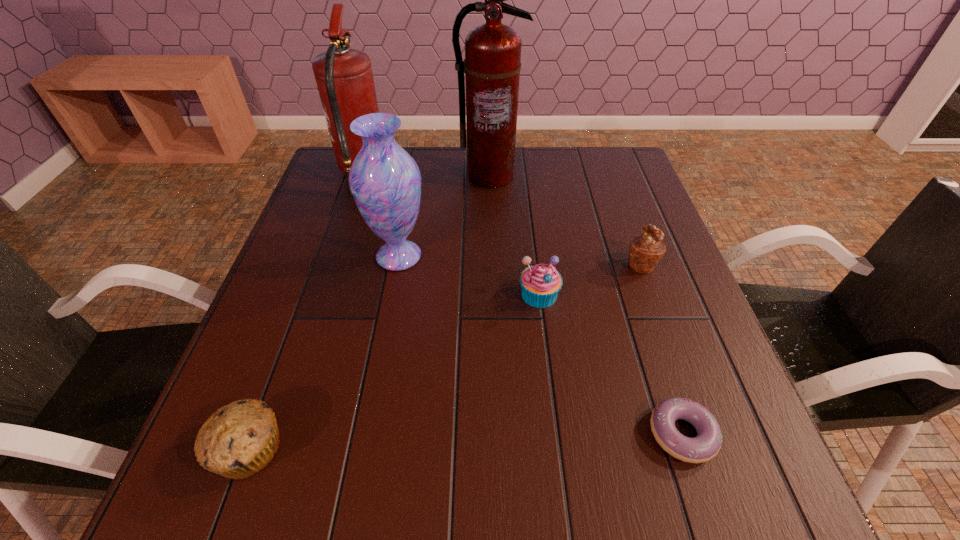
Locate an element on the screen. This screenshot has height=540, width=960. vacant space located at the front of the left fire extinguisher where the nozzle is aimed is located at coordinates pos(507,175).

Locate an element on the screen. This screenshot has width=960, height=540. vacant space positioned 0.360m on the front of the third tallest object is located at coordinates (367, 431).

Image resolution: width=960 pixels, height=540 pixels. Identify the location of free space located 0.170m on the left of the rightmost muffin. (551, 264).

I want to click on free spot located on the right of the second muffin from right to left, so click(615, 294).

The width and height of the screenshot is (960, 540). What are the coordinates of `vacant region located on the back of the leftmost muffin` in the screenshot? It's located at (297, 320).

At what (x,y) coordinates should I click in order to perform the action: click on free space located on the back of the doughnut. Please return your answer as a coordinate pair (x, y). The image size is (960, 540). Looking at the image, I should click on (650, 335).

Where is `muffin located in the near edge section of the desktop`? muffin located in the near edge section of the desktop is located at coordinates (238, 440).

I want to click on doughnut present at the near edge, so click(x=707, y=443).

In order to click on fire extinguisher present at the left edge in this screenshot , I will do `click(344, 77)`.

Where is `muffin that is at the left edge`? The image size is (960, 540). muffin that is at the left edge is located at coordinates (238, 440).